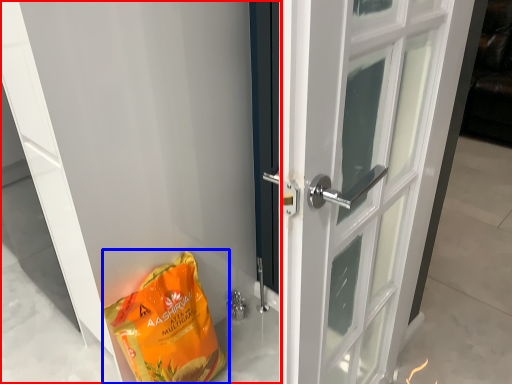
Question: Which point is closer to the camera, door (highlighted by a red box) or grocery bag (highlighted by a blue box)?

Choices:
 (A) door
 (B) grocery bag

Answer: (A)